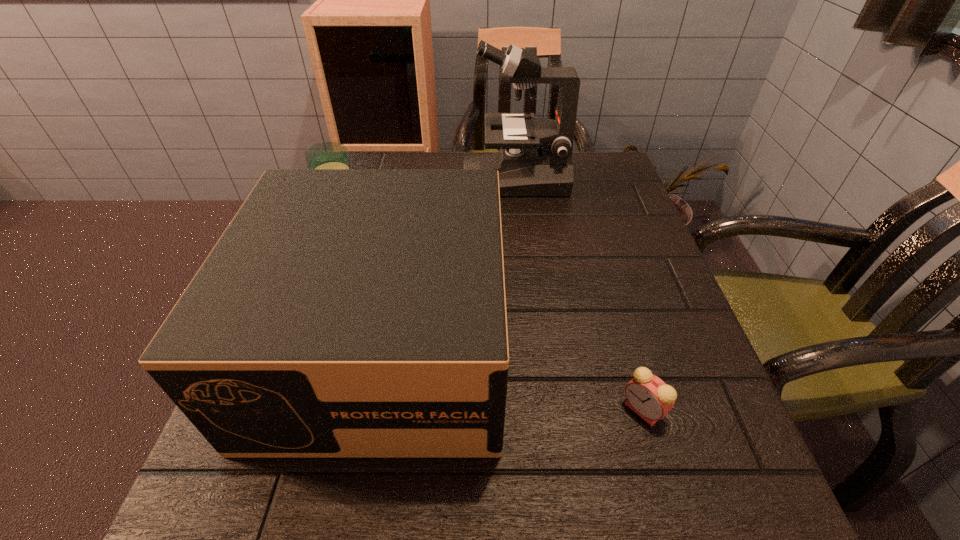
At what (x,y) coordinates should I click in order to perform the action: click on the farthest object. Please return your answer as a coordinate pair (x, y). Looking at the image, I should click on (535, 159).

Where is `microscope`? The height and width of the screenshot is (540, 960). microscope is located at coordinates (535, 159).

Identify the location of box. The width and height of the screenshot is (960, 540). (344, 313).

At what (x,y) coordinates should I click in order to perform the action: click on the third nearest object. Please return your answer as a coordinate pair (x, y). This screenshot has width=960, height=540. Looking at the image, I should click on (327, 155).

Identify the location of glass. (327, 155).

I want to click on alarm clock, so click(648, 396).

The width and height of the screenshot is (960, 540). In order to click on free region located through the eyepieces of the farthest object in this screenshot , I will do `click(441, 179)`.

Locate an element on the screen. The width and height of the screenshot is (960, 540). free spot located 0.340m through the eyepieces of the farthest object is located at coordinates (335, 179).

Where is `vacant space located through the eyepieces of the farthest object`? The width and height of the screenshot is (960, 540). vacant space located through the eyepieces of the farthest object is located at coordinates (388, 179).

Locate an element on the screen. free space located 0.100m on the front-facing side of the third shortest object is located at coordinates (346, 536).